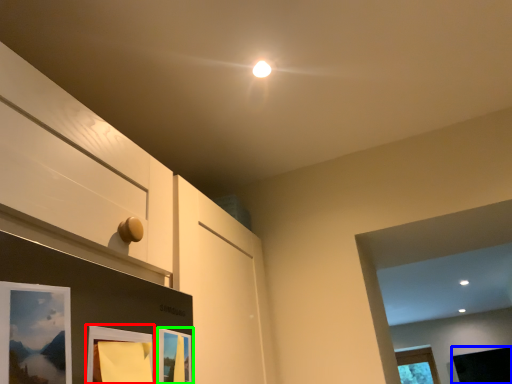
Question: Based on their relative distances, which object is farther from picture frame (highlighted by a red box)? Choose from picture frame (highlighted by a blue box) and picture frame (highlighted by a green box).

Choices:
 (A) picture frame
 (B) picture frame

Answer: (A)